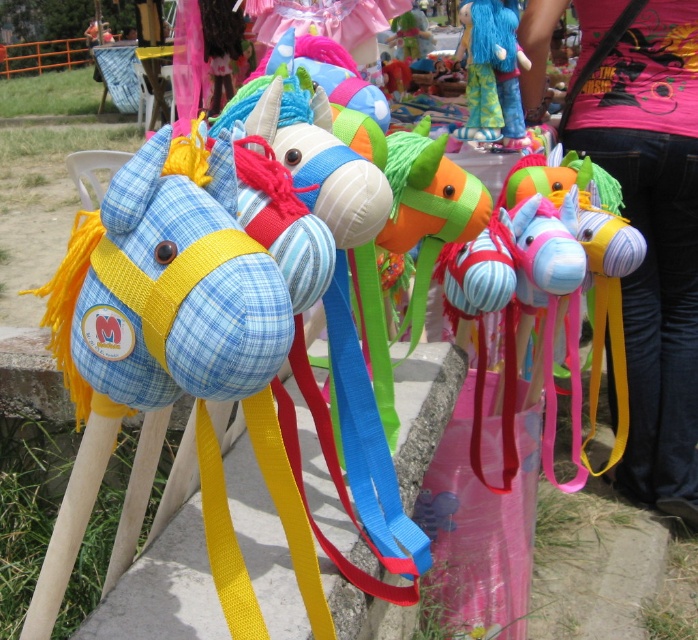
You are standing at the base of the stall where the matte pink shirt at upper right is displayed. You want to hand a gift to a friend who is standing 5 feet away from you. Can you reach them without moving?

The distance between you and your friend is 5.66 feet, so you cannot reach them without moving since 5.66 feet is greater than 5 feet.

You are a customer at a fair looking for a gift. You see the matte pink shirt at upper right and the blue fabric doll at upper center. Which item is positioned more to the right?

The matte pink shirt at upper right is positioned more to the right than the blue fabric doll at upper center.